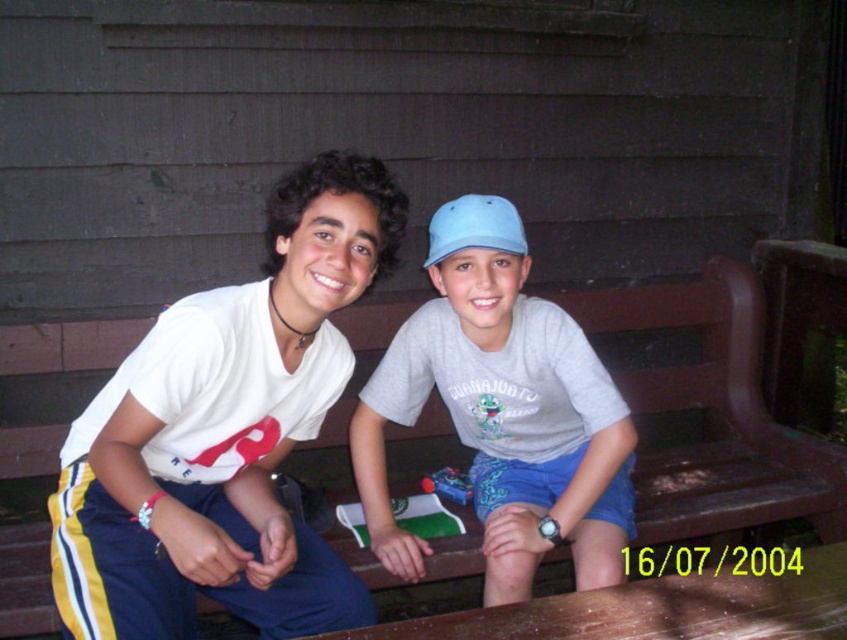
You are standing in front of the wooden steps where the two people are sitting. You want to place a small potted plant between the gray cotton shirt at center and the brown wooden bench at center. Based on their positions, where should you place the plant?

The gray cotton shirt at center is located above the brown wooden bench at center, so you should place the small potted plant between them at the position of the brown wooden bench at center since it is lower.

You are standing in front of the two people sitting on the wooden steps. You want to place a small gift on the brown wooden bench at center so that it is visible to both people. Where should you place the gift in relation to the light blue fabric baseball cap at center?

Place the gift on the brown wooden bench at center, which is closer to you than the light blue fabric baseball cap at center. This way, the gift will be in front of the baseball cap, making it visible to both people.